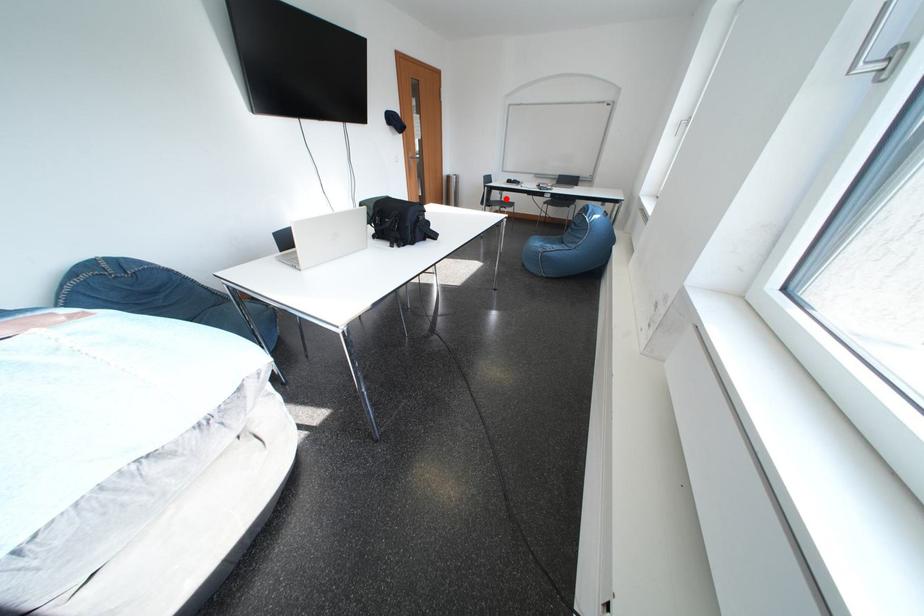
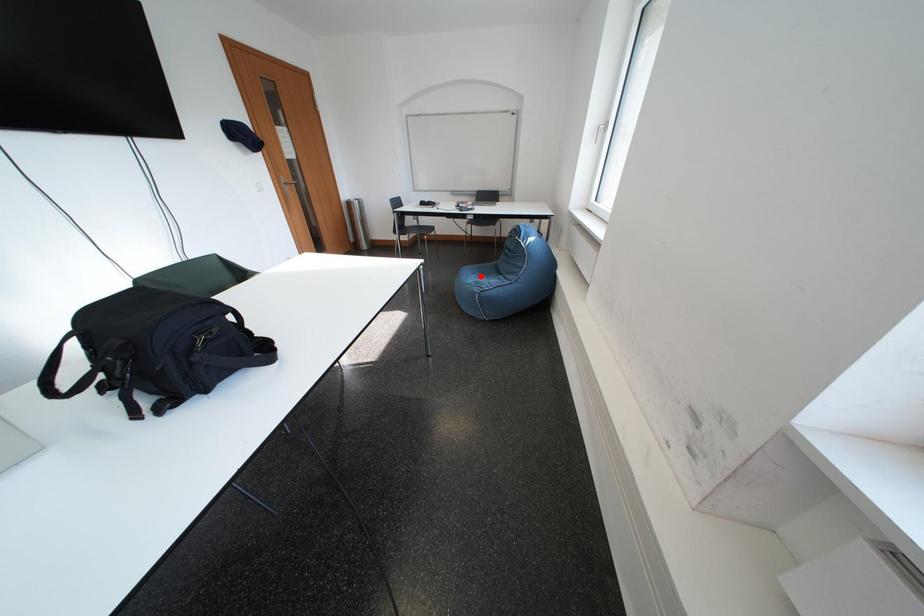
I am providing you with two images of the same scene from different viewpoints. A red point is marked on the first image and another point is marked on the second image. Do the highlighted points in image1 and image2 indicate the same real-world spot?

No